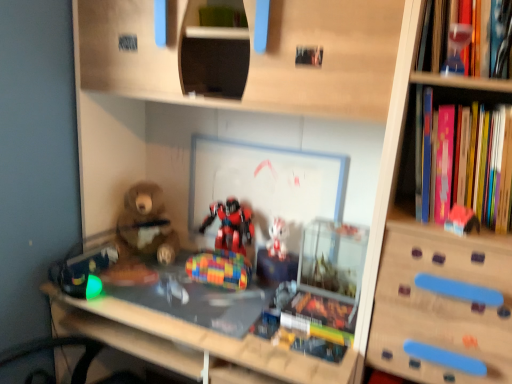
In order to click on free point in front of shiny plastic robot at center, acting as the third toy starting from the left in this screenshot , I will do `click(217, 297)`.